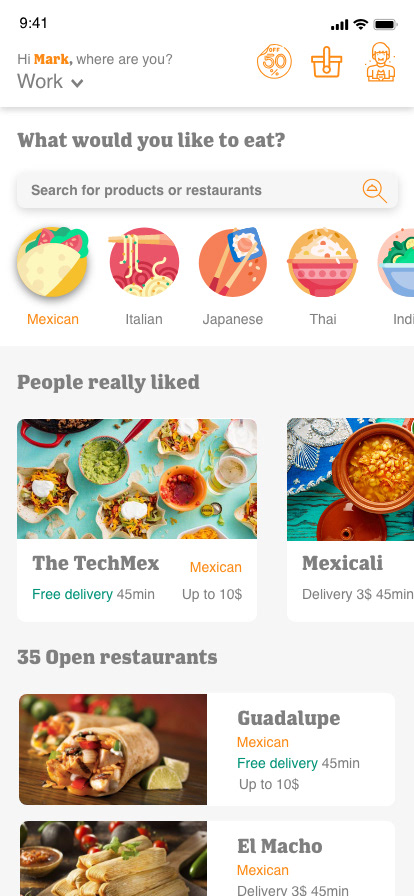
The width and height of the screenshot is (414, 896). Identify the location of table. (33, 452), (305, 502), (193, 709), (175, 824).